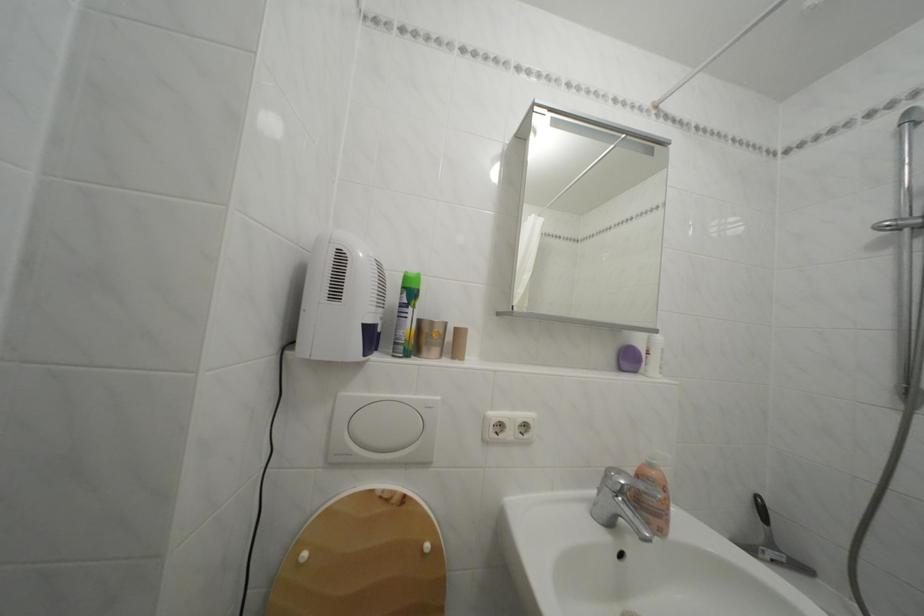
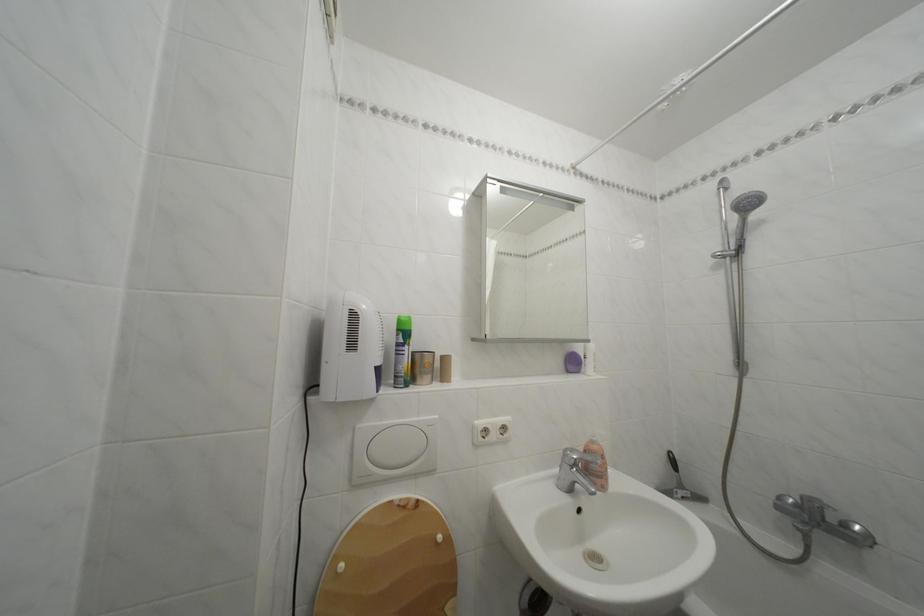
Find the pixel in the second image that matches (x=411, y=294) in the first image.

(407, 336)